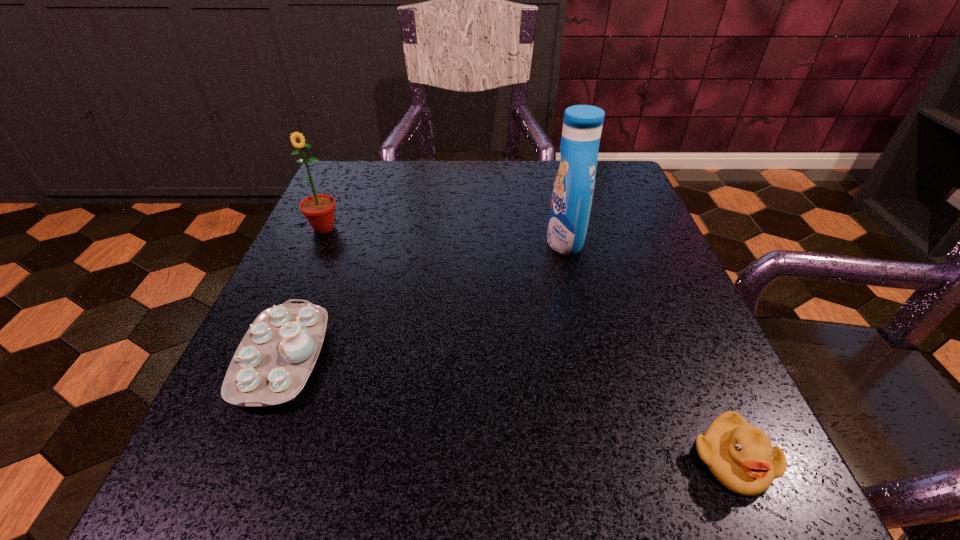
Find the location of a particular element. vacant point at the right edge is located at coordinates (648, 330).

Identify the location of vacant area at the far right corner of the desktop. The width and height of the screenshot is (960, 540). (627, 195).

I want to click on vacant point at the near right corner, so click(x=774, y=503).

You are a GUI agent. You are given a task and a screenshot of the screen. Output one action in this format:
    pyautogui.click(x=<x>, y=<y>)
    Task: Click on the vacant area that lies between the second tallest object and the third object from left to right
    
    Given the screenshot: What is the action you would take?
    pyautogui.click(x=444, y=234)

The image size is (960, 540). Identify the location of free point between the chinaware and the rightmost object. click(x=507, y=409).

I want to click on unoccupied position between the duckling and the sunflower, so click(528, 344).

Where is `vacant space in between the third farthest object and the detergent`? The width and height of the screenshot is (960, 540). vacant space in between the third farthest object and the detergent is located at coordinates (423, 299).

Identify the location of vacant space that is in between the second tallest object and the second nearest object. (303, 293).

Locate an element on the screen. The image size is (960, 540). empty space between the chinaware and the sunflower is located at coordinates (303, 293).

Locate an element on the screen. The image size is (960, 540). blank region between the chinaware and the second object from right to left is located at coordinates (423, 299).